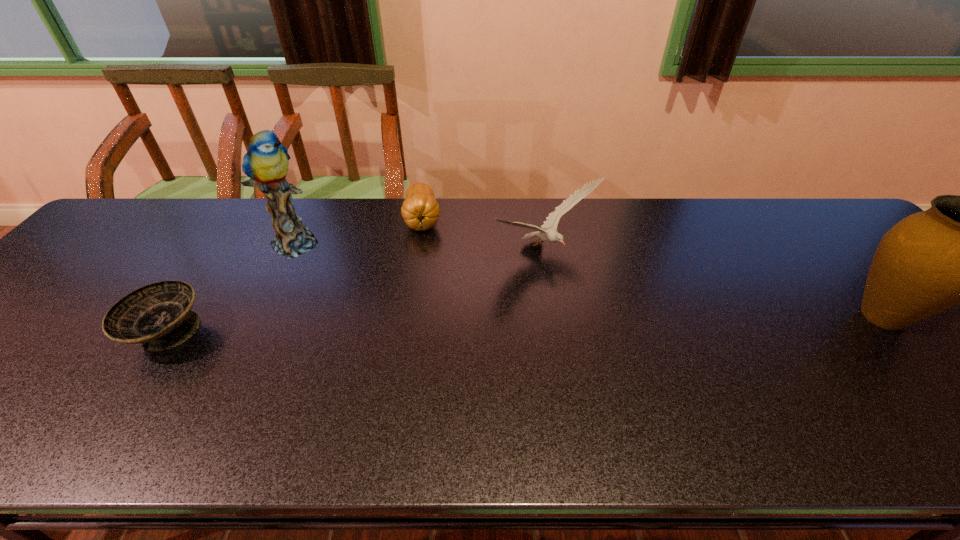
The width and height of the screenshot is (960, 540). I want to click on vacant region located 0.100m on the back of the bowl, so click(x=204, y=277).

I want to click on vacant space situated 0.310m on the back of the rightmost object, so click(x=795, y=218).

In order to click on vacant region located on the stem side of the gourd in this screenshot , I will do `click(428, 342)`.

Where is `vacant space located on the stem side of the gourd`? vacant space located on the stem side of the gourd is located at coordinates (427, 328).

You are a GUI agent. You are given a task and a screenshot of the screen. Output one action in this format:
    pyautogui.click(x=<x>, y=<y>)
    Task: Click on the vacant region located 0.250m on the stem side of the gourd
    This screenshot has height=540, width=960.
    Given the screenshot: What is the action you would take?
    pyautogui.click(x=426, y=304)

At what (x,y) coordinates should I click in order to perform the action: click on vacant space located on the face of the tallest object. Please return your answer as a coordinate pair (x, y). The width and height of the screenshot is (960, 540). Looking at the image, I should click on (378, 289).

Find the location of a particular element. The width and height of the screenshot is (960, 540). vacant region located 0.350m on the face of the tallest object is located at coordinates (404, 304).

Where is `vacant space located 0.260m on the face of the tallest object`? The width and height of the screenshot is (960, 540). vacant space located 0.260m on the face of the tallest object is located at coordinates (378, 289).

At what (x,y) coordinates should I click in order to perform the action: click on vacant area situated 0.390m at the tip of the beak of the fourth object from left to right. Please return your answer as a coordinate pair (x, y). Looking at the image, I should click on (708, 379).

Find the location of `vacant space located at the tip of the beak of the fourth object from left to right`. vacant space located at the tip of the beak of the fourth object from left to right is located at coordinates (620, 306).